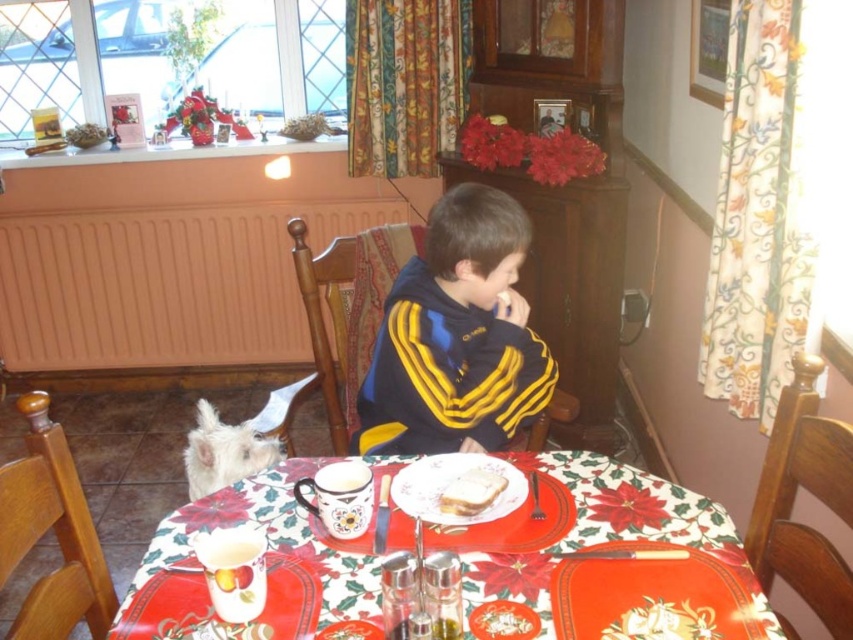
Question: Estimate the real-world distances between objects in this image. Which object is farther from the white bread at center?

Choices:
 (A) black/yellow striped sweater at center
 (B) white ceramic plate at center
 (C) white fur dog at lower left
 (D) white glossy plate at center

Answer: (C)

Question: Estimate the real-world distances between objects in this image. Which object is closer to the white ceramic plate at center?

Choices:
 (A) white fur dog at lower left
 (B) black/yellow striped sweater at center
 (C) white glossy plate at center

Answer: (C)

Question: Is white ceramic plate at center positioned in front of white fur dog at lower left?

Choices:
 (A) no
 (B) yes

Answer: (B)

Question: Does white ceramic plate at center appear on the left side of white fur dog at lower left?

Choices:
 (A) no
 (B) yes

Answer: (A)

Question: Is black/yellow striped sweater at center above white bread at center?

Choices:
 (A) no
 (B) yes

Answer: (B)

Question: Which of these objects is positioned closest to the black/yellow striped sweater at center?

Choices:
 (A) white ceramic plate at center
 (B) white fur dog at lower left
 (C) white bread at center
 (D) white glossy plate at center

Answer: (A)